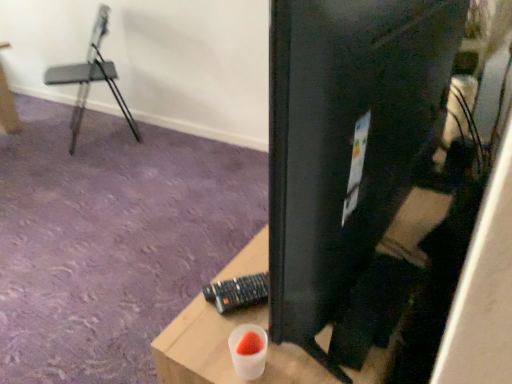
This screenshot has width=512, height=384. I want to click on free space in front of metallic gray armchair at left, so click(75, 165).